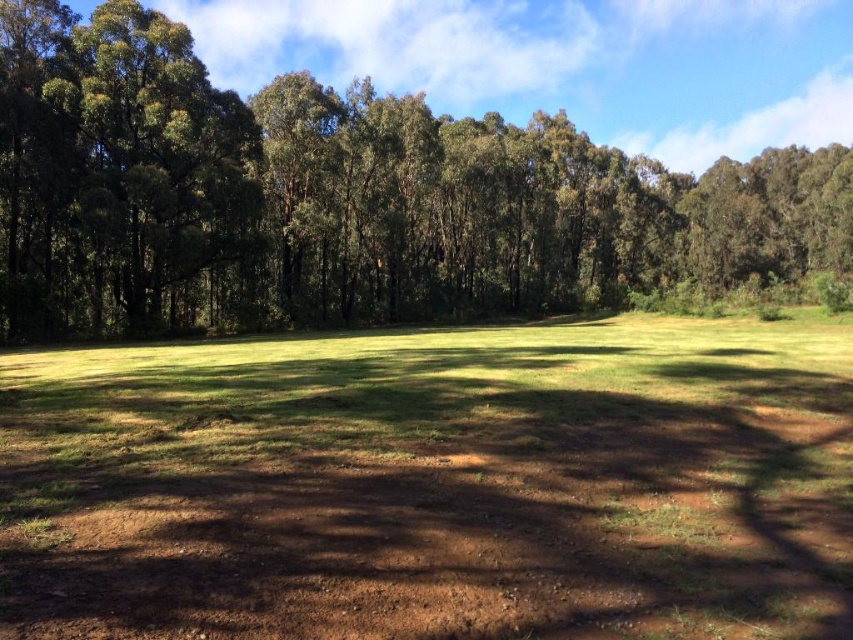
Question: Which of the following is the farthest from the observer?

Choices:
 (A) green leafy tree at center
 (B) brown dirt field at center
 (C) green leafy tree at left

Answer: (A)

Question: Which of the following is the farthest from the observer?

Choices:
 (A) (325, 506)
 (B) (450, 292)

Answer: (B)

Question: Which point is farther to the camera?

Choices:
 (A) (751, 273)
 (B) (39, 305)

Answer: (A)

Question: Considering the relative positions of brown dirt field at center and green leafy tree at center in the image provided, where is brown dirt field at center located with respect to green leafy tree at center?

Choices:
 (A) right
 (B) left

Answer: (B)

Question: Can you confirm if brown dirt field at center is positioned below green leafy tree at center?

Choices:
 (A) no
 (B) yes

Answer: (B)

Question: Observing the image, what is the correct spatial positioning of green leafy tree at center in reference to green leafy tree at left?

Choices:
 (A) above
 (B) below

Answer: (A)